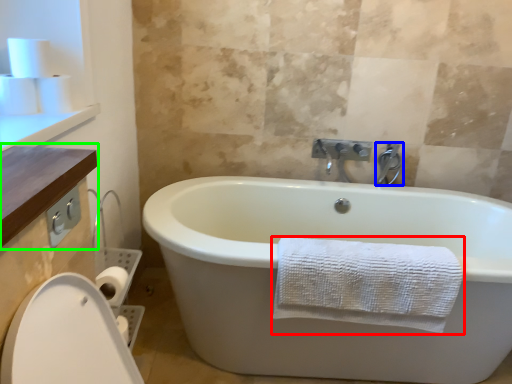
Question: Based on their relative distances, which object is farther from towel (highlighted by a red box)? Choose from tap (highlighted by a blue box) and counter top (highlighted by a green box).

Choices:
 (A) tap
 (B) counter top

Answer: (A)